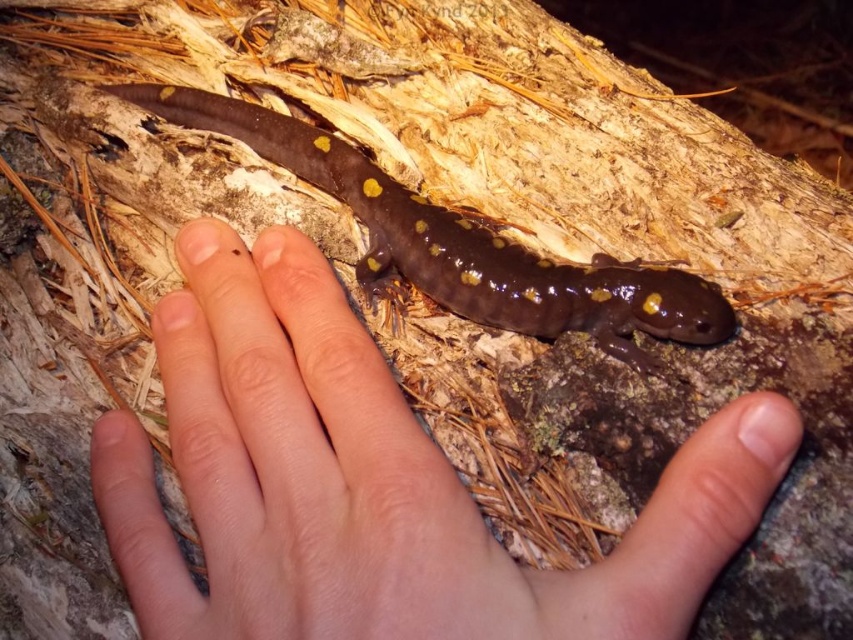
Based on the scene described, where is the smooth skin hand at center located relative to the shiny brown salamander at center?

The smooth skin hand at center is to the right of the shiny brown salamander at center.

You are a wildlife photographer aiming to capture the spotted salamander without disturbing it. Your camera is positioned to the left of the smooth skin hand at center. To avoid blocking the salamander, should you move your hand to the right or left?

Since the camera is to the left of the smooth skin hand at center, moving the hand to the right would keep it out of the camera frame, allowing an unobstructed view of the salamander.

You are a photographer trying to capture a clear photo of the shiny brown salamander at center. However, there is a smooth skin hand at center blocking your view. Can you tell me which object is closer to the camera so I can adjust my shot?

The smooth skin hand at center is closer to the viewer than the shiny brown salamander at center, so the hand is blocking the view of the salamander. To capture the salamander clearly, you need to move the hand out of the way or adjust your angle to avoid the obstruction.